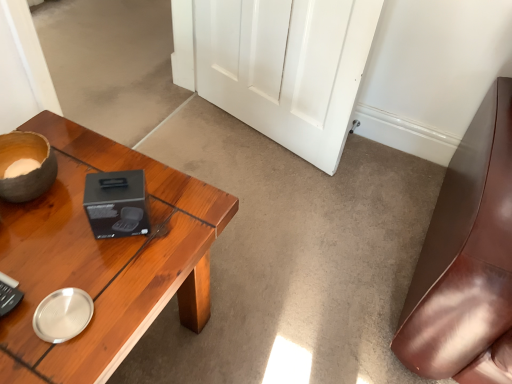
This screenshot has width=512, height=384. Identify the location of free location to the right of white glossy door at center. (370, 185).